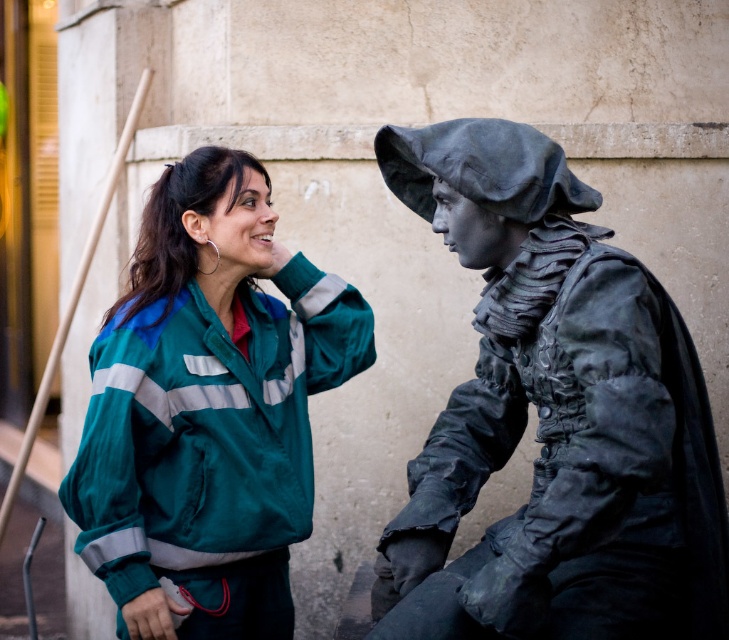
Question: Does black matte statue at right appear on the left side of green fabric jacket at center?

Choices:
 (A) yes
 (B) no

Answer: (B)

Question: Which of the following is the closest to the observer?

Choices:
 (A) click(499, 541)
 (B) click(136, 513)

Answer: (A)

Question: Can you confirm if black matte statue at right is positioned above green fabric jacket at center?

Choices:
 (A) no
 (B) yes

Answer: (A)

Question: Can you confirm if black matte statue at right is positioned to the right of green fabric jacket at center?

Choices:
 (A) yes
 (B) no

Answer: (A)